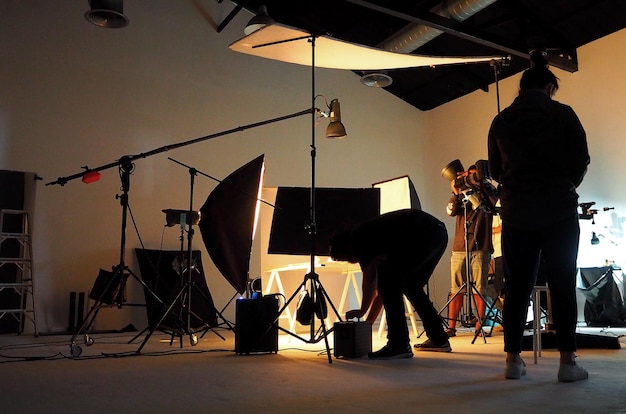
The width and height of the screenshot is (626, 414). Find the location of `step ladder`. step ladder is located at coordinates (26, 259).